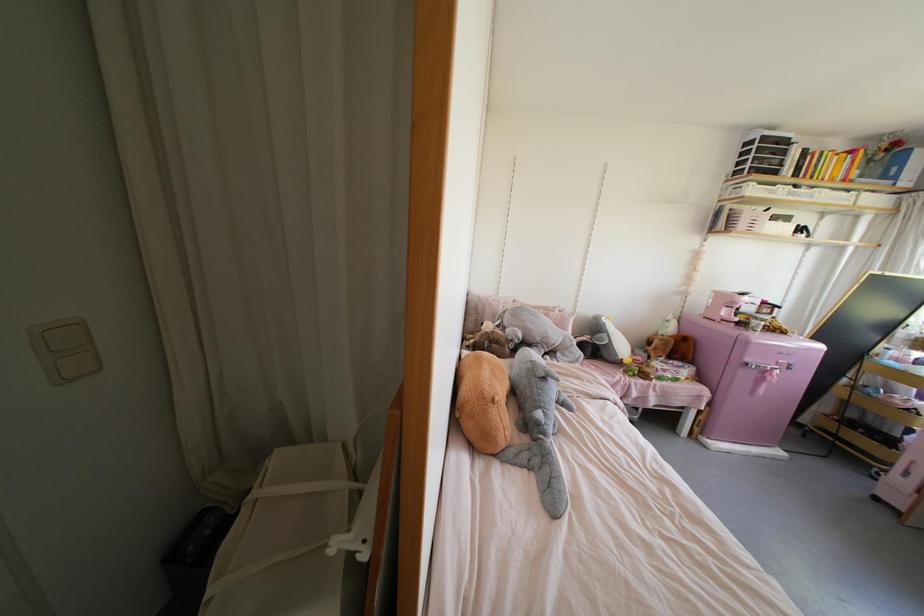
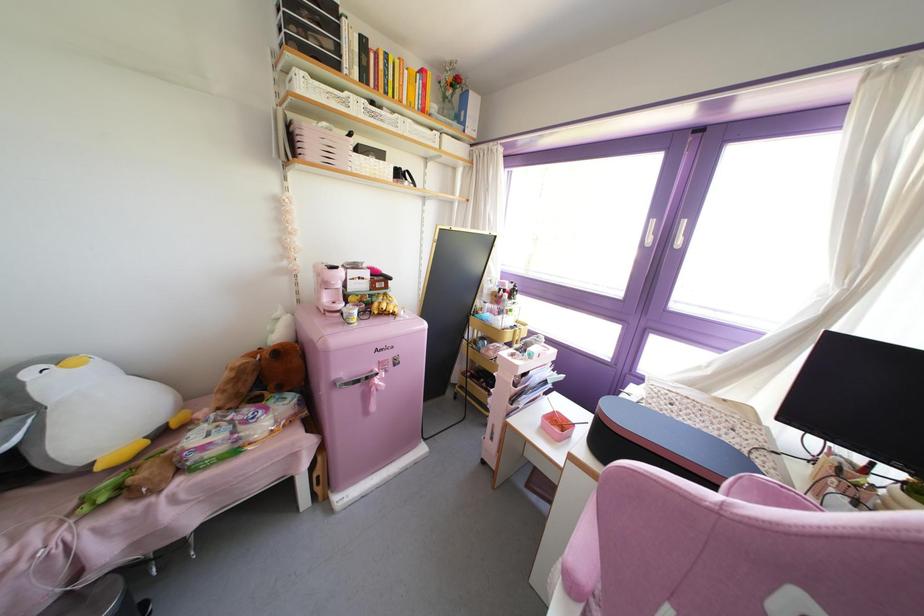
In the second image, find the point that corresponds to point (779, 223) in the first image.

(371, 160)